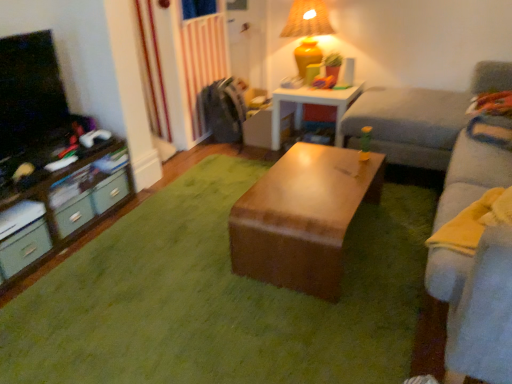
Locate an element on the screen. This screenshot has width=512, height=384. vacant space in front of matte gray drawer at lower left, placed as the first drawer when sorted from front to back is located at coordinates (28, 292).